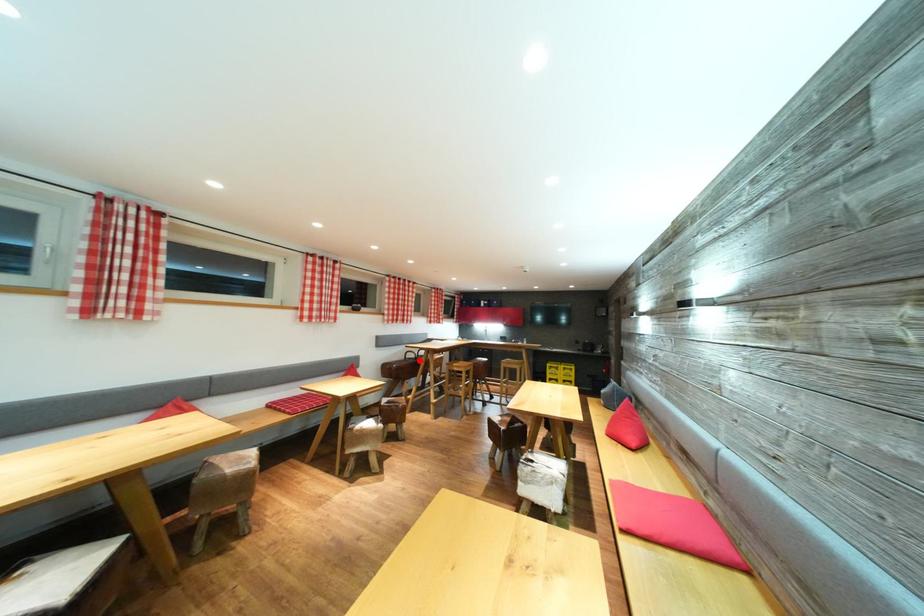
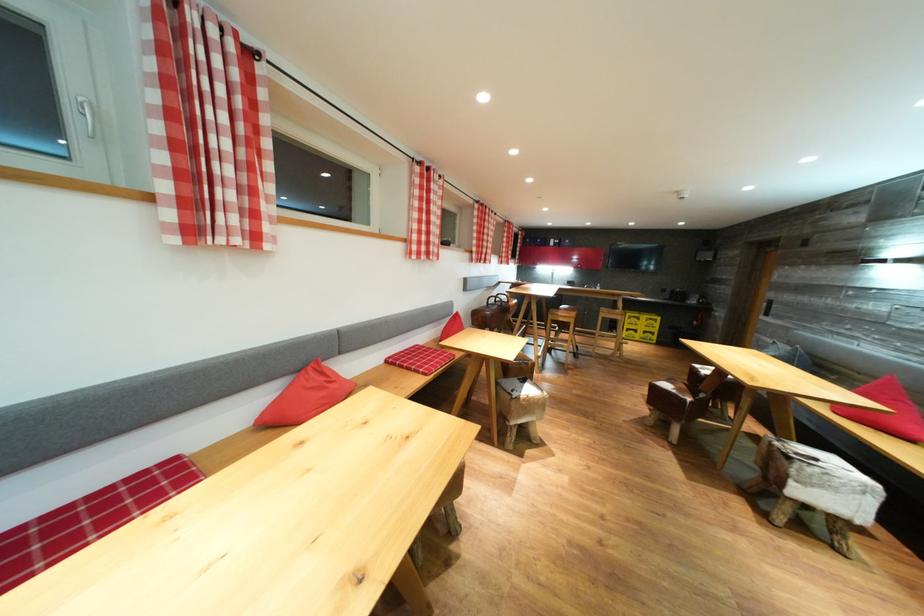
Where in the second image is the point corresponding to the highlighted location from the first image?

(499, 306)